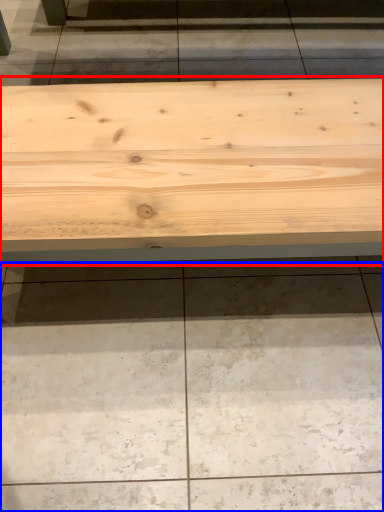
Question: Among these objects, which one is farthest to the camera, table (highlighted by a red box) or concrete (highlighted by a blue box)?

Choices:
 (A) table
 (B) concrete

Answer: (B)